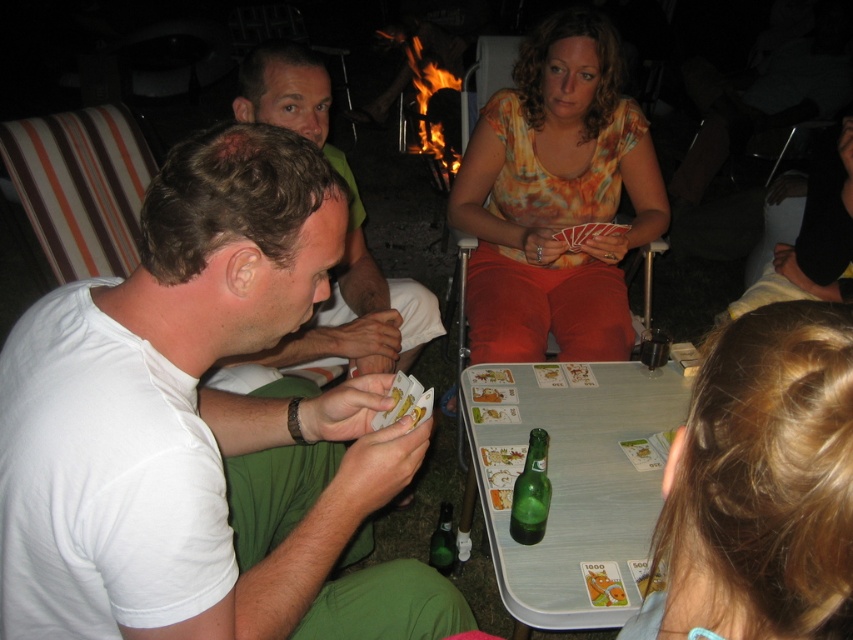
Based on the scene description, which object, the white cotton shirt at left or the matte green shirt at center, has a greater width?

The white cotton shirt at left might be wider than matte green shirt at center according to the description.

You are a photographer trying to capture a candid shot of the card game. Your camera has a maximum focus range of 16 inches. Can you take a photo that clearly captures both the white cotton shirt at left and the matte green shirt at center without moving the camera?

The distance between the white cotton shirt at left and the matte green shirt at center is 17.22 inches, which exceeds the camera maximum focus range of 16 inches. Therefore, you cannot capture both clearly in the same shot without moving the camera.